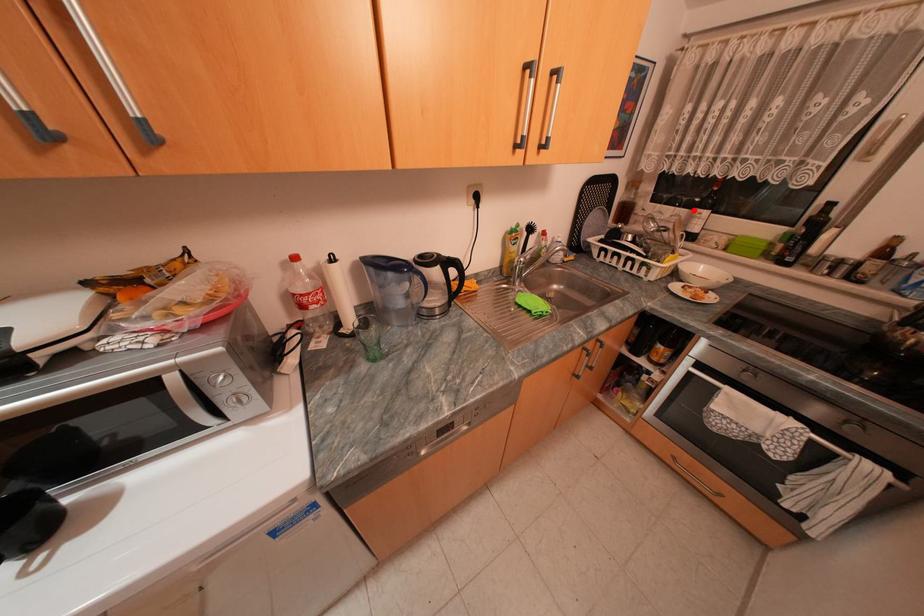
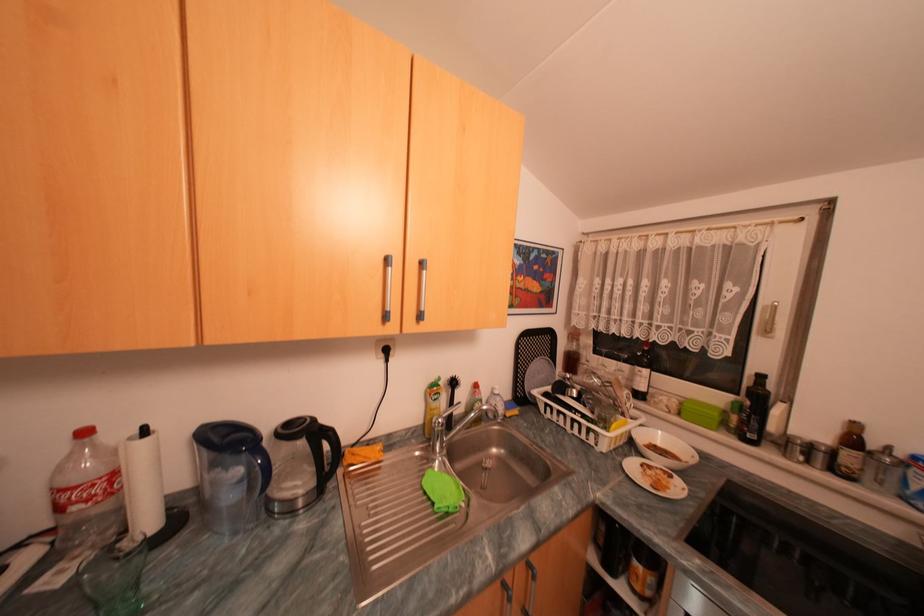
Question: I am providing you with two images of the same scene from different viewpoints. A red point is marked on the first image. Can you still see the location of the red point in image 2?

Choices:
 (A) Yes
 (B) No

Answer: (A)